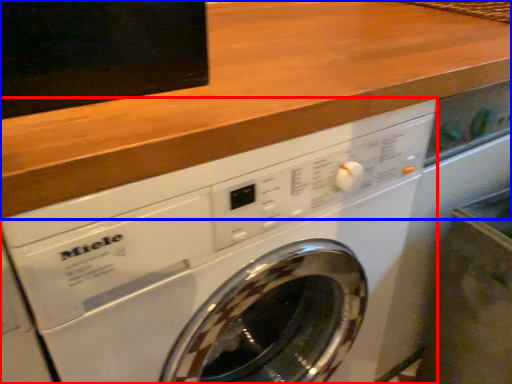
Question: Which object is closer to the camera taking this photo, washing machine (highlighted by a red box) or counter top (highlighted by a blue box)?

Choices:
 (A) washing machine
 (B) counter top

Answer: (B)